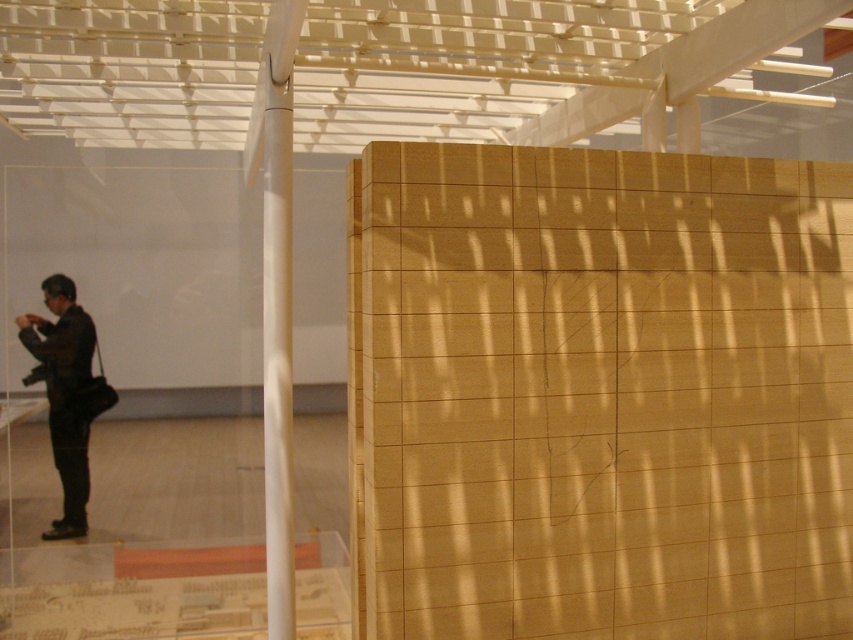
You are an event planner setting up a photo shoot in this gallery. You need to place a 6.5 feet wide backdrop between the white smooth pole at center and the black matte jacket at left. Will there be enough space?

The distance between the white smooth pole at center and the black matte jacket at left is 7.85 feet. Since the backdrop is 6.5 feet wide, there is sufficient space as 6.5 feet is less than 7.85 feet.

You are standing in the gallery and notice two points marked in the image. The first point is at coordinates point (285, 198) and the second is at point (18, 321). Which point is nearer to you?

Point (285, 198) is closer to the viewer than point (18, 321).

You are an interior designer assessing the space. You need to hang a large painting that requires a support structure. The painting is as tall as the black matte jacket at left. Will the white smooth pole at center be tall enough to accommodate the painting?

The white smooth pole at center is taller than the black matte jacket at left. Since the painting is as tall as the black matte jacket at left, the white smooth pole at center will be tall enough to accommodate the painting.